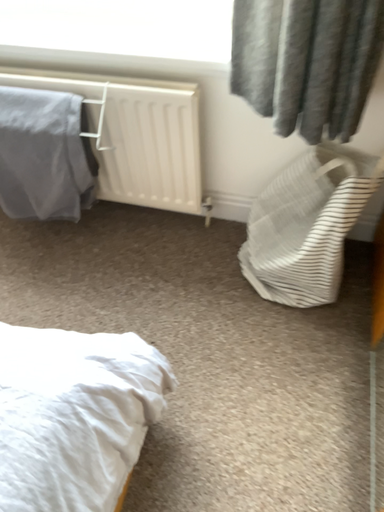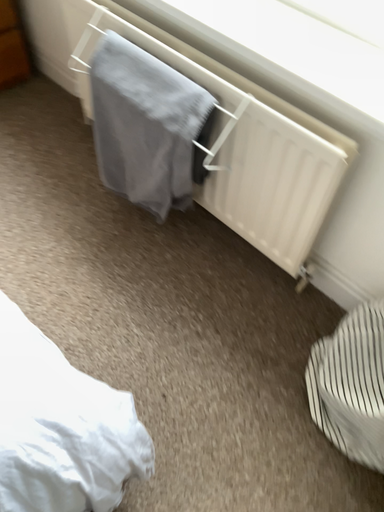
Question: How did the camera likely rotate when shooting the video?

Choices:
 (A) rotated left
 (B) rotated right

Answer: (A)